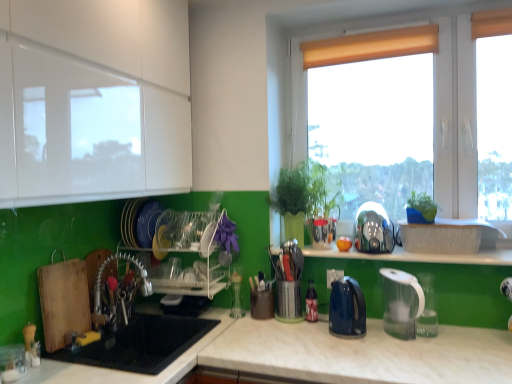
Describe the element at coordinates (401, 303) in the screenshot. I see `clear plastic water filter at lower right, acting as the 1th kitchen appliance starting from the right` at that location.

The image size is (512, 384). What do you see at coordinates (303, 195) in the screenshot? I see `green matte plant at center, the 2th plant viewed from the front` at bounding box center [303, 195].

Where is `green plastic plant at right, the 2th plant in the left-to-right sequence`? The width and height of the screenshot is (512, 384). green plastic plant at right, the 2th plant in the left-to-right sequence is located at coordinates (421, 209).

The image size is (512, 384). Describe the element at coordinates (373, 229) in the screenshot. I see `shiny metallic kettle at center-right, which is the 2th appliance in bottom-to-top order` at that location.

The width and height of the screenshot is (512, 384). What do you see at coordinates (311, 303) in the screenshot?
I see `translucent plastic bottle at center` at bounding box center [311, 303].

The image size is (512, 384). Identify the location of translucent plastic bottle at center. (311, 303).

At what (x,y) coordinates should I click in order to perform the action: click on clear plastic water filter at lower right, which ranks as the second kitchen appliance in left-to-right order. Please return your answer as a coordinate pair (x, y). The image size is (512, 384). Looking at the image, I should click on (401, 303).

Is brushed metal faucet at lower left at the left side of black matte sink at lower left?

Yes.

From a real-world perspective, is brushed metal faucet at lower left positioned over black matte sink at lower left based on gravity?

Indeed, from a real-world perspective, brushed metal faucet at lower left stands above black matte sink at lower left.

Considering the points (129, 261) and (149, 353), which point is in front, point (129, 261) or point (149, 353)?

The point (149, 353) is in front.

Consider the image. Is black matte sink at lower left at the back of brushed metal faucet at lower left?

No.

At what (x,y) coordinates should I click in order to perform the action: click on window that appears above the metallic silver toaster at center (from the image's perspective). Please return your answer as a coordinate pair (x, y). Looking at the image, I should click on pyautogui.click(x=455, y=116).

Which object is positioned more to the left, matte white window at upper right or metallic silver toaster at center?

Positioned to the left is metallic silver toaster at center.

Which object is more forward, matte white window at upper right or metallic silver toaster at center?

Positioned in front is metallic silver toaster at center.

Considering the sizes of objects green matte plant at center, which appears as the 1th plant when viewed from the left, and matte white window at upper right in the image provided, who is smaller, green matte plant at center, which appears as the 1th plant when viewed from the left, or matte white window at upper right?

Smaller between the two is green matte plant at center, which appears as the 1th plant when viewed from the left.

Which object is thinner, green matte plant at center, the 2th plant viewed from the front, or matte white window at upper right?

matte white window at upper right.

Does green matte plant at center, the 2th plant viewed from the front, have a lesser height compared to matte white window at upper right?

Yes.

Based on the photo, can you tell me how much clear plastic water filter at lower right, acting as the 1th kitchen appliance starting from the right, and brushed metal faucet at lower left differ in facing direction?

There is a 59.1-degree angle between the facing directions of clear plastic water filter at lower right, acting as the 1th kitchen appliance starting from the right, and brushed metal faucet at lower left.

Does point (390, 332) come farther from viewer compared to point (129, 258)?

No, it is not.

From a real-world perspective, which object stands above the other?

In real-world perspective, brushed metal faucet at lower left is above.

Looking at their sizes, would you say clear plastic water filter at lower right, which ranks as the second kitchen appliance in left-to-right order, is wider or thinner than brushed metal faucet at lower left?

Clearly, clear plastic water filter at lower right, which ranks as the second kitchen appliance in left-to-right order, has more width compared to brushed metal faucet at lower left.

Locate an element on the screen. This screenshot has height=384, width=512. bottle on the right of black matte sink at lower left is located at coordinates (311, 303).

In the scene shown: Is black matte sink at lower left closer to the viewer compared to translucent plastic bottle at center?

Yes, it is.

Is black matte sink at lower left thinner than translucent plastic bottle at center?

Incorrect, the width of black matte sink at lower left is not less than that of translucent plastic bottle at center.

Considering the sizes of objects black matte sink at lower left and translucent plastic bottle at center in the image provided, who is smaller, black matte sink at lower left or translucent plastic bottle at center?

Smaller between the two is translucent plastic bottle at center.

Which object is closer to the camera taking this photo, metallic utensil holder at center, acting as the 1th appliance starting from the left, or translucent plastic bottle at center?

Positioned in front is metallic utensil holder at center, acting as the 1th appliance starting from the left.

In the scene shown: Based on their positions, is metallic utensil holder at center, which is the 2th appliance in right-to-left order, located to the left or right of translucent plastic bottle at center?

Clearly, metallic utensil holder at center, which is the 2th appliance in right-to-left order, is on the left of translucent plastic bottle at center in the image.

Can you confirm if metallic utensil holder at center, the first appliance in the bottom-to-top sequence, is smaller than translucent plastic bottle at center?

Actually, metallic utensil holder at center, the first appliance in the bottom-to-top sequence, might be larger than translucent plastic bottle at center.

From their relative heights in the image, would you say metallic utensil holder at center, the 2th appliance in the top-to-bottom sequence, is taller or shorter than translucent plastic bottle at center?

Clearly, metallic utensil holder at center, the 2th appliance in the top-to-bottom sequence, is taller compared to translucent plastic bottle at center.

From the image's perspective, is translucent plastic bottle at center above metallic utensil holder at center, the first appliance in the bottom-to-top sequence?

No, from the image's perspective, translucent plastic bottle at center is not over metallic utensil holder at center, the first appliance in the bottom-to-top sequence.

Find the location of `appliance lying on the left of translucent plastic bottle at center`. appliance lying on the left of translucent plastic bottle at center is located at coordinates (288, 281).

Is translucent plastic bottle at center looking in the opposite direction of metallic utensil holder at center, the first appliance in the bottom-to-top sequence?

No, translucent plastic bottle at center is not facing the opposite direction of metallic utensil holder at center, the first appliance in the bottom-to-top sequence.

Is translucent plastic bottle at center not within metallic utensil holder at center, the first appliance in the bottom-to-top sequence?

Yes, translucent plastic bottle at center is located beyond the bounds of metallic utensil holder at center, the first appliance in the bottom-to-top sequence.

You are a GUI agent. You are given a task and a screenshot of the screen. Output one action in this format:
    pyautogui.click(x=<x>, y=<y>)
    Task: Click on the faucet above the black matte sink at lower left (from the image's perspective)
    The image size is (512, 384).
    Given the screenshot: What is the action you would take?
    pyautogui.click(x=119, y=293)

The width and height of the screenshot is (512, 384). Find the location of `window that is above the metallic silver toaster at center (from a real-world perspective)`. window that is above the metallic silver toaster at center (from a real-world perspective) is located at coordinates (455, 116).

Which object lies further to the anchor point blue glossy electric kettle at center, which appears as the 1th kitchen appliance when viewed from the left, matte white window at upper right or translucent plastic bottle at center?

The object further to blue glossy electric kettle at center, which appears as the 1th kitchen appliance when viewed from the left, is matte white window at upper right.

From the image, which object appears to be nearer to brushed metal faucet at lower left, translucent plastic bottle at center or clear plastic water filter at lower right, which ranks as the second kitchen appliance in left-to-right order?

translucent plastic bottle at center is closer to brushed metal faucet at lower left.

Estimate the real-world distances between objects in this image. Which object is closer to shiny metallic kettle at center-right, the 1th appliance from the right, blue glossy electric kettle at center, which appears as the 1th kitchen appliance when viewed from the left, or beige fabric curtain at upper center?

Among the two, blue glossy electric kettle at center, which appears as the 1th kitchen appliance when viewed from the left, is located nearer to shiny metallic kettle at center-right, the 1th appliance from the right.

Considering their positions, is matte white window at upper right positioned further to brushed metal faucet at lower left than translucent plastic bottle at center?

Among the two, matte white window at upper right is located further to brushed metal faucet at lower left.

Based on their spatial positions, is shiny metallic kettle at center-right, the 1th appliance from the right, or metallic utensil holder at center, the 2th appliance in the top-to-bottom sequence, closer to beige fabric curtain at upper center?

shiny metallic kettle at center-right, the 1th appliance from the right, lies closer to beige fabric curtain at upper center than the other object.

Based on the photo, looking at the image, which one is located further to shiny metallic kettle at center-right, which is the 2th appliance in bottom-to-top order, beige fabric curtain at upper center or clear plastic water filter at lower right, acting as the 1th kitchen appliance starting from the right?

Among the two, beige fabric curtain at upper center is located further to shiny metallic kettle at center-right, which is the 2th appliance in bottom-to-top order.

When comparing their distances from green plastic plant at right, which is the first plant in front-to-back order, does blue glossy electric kettle at center, the 2th kitchen appliance in the right-to-left sequence, or translucent plastic bottle at center seem closer?

blue glossy electric kettle at center, the 2th kitchen appliance in the right-to-left sequence, is positioned closer to the anchor green plastic plant at right, which is the first plant in front-to-back order.

Estimate the real-world distances between objects in this image. Which object is further from clear plastic water filter at lower right, which ranks as the second kitchen appliance in left-to-right order, green plastic plant at right, arranged as the 1th plant when viewed from the right, or translucent plastic bottle at center?

translucent plastic bottle at center is positioned further to the anchor clear plastic water filter at lower right, which ranks as the second kitchen appliance in left-to-right order.

The width and height of the screenshot is (512, 384). What are the coordinates of `shelf between brushed metal faucet at lower left and matte white window at upper right from left to right` in the screenshot? It's located at (185, 276).

Find the location of `shelf between black matte sink at lower left and shiny metallic kettle at center-right, the 1th appliance from the right`. shelf between black matte sink at lower left and shiny metallic kettle at center-right, the 1th appliance from the right is located at coordinates (185, 276).

The width and height of the screenshot is (512, 384). In order to click on appliance between black matte sink at lower left and shiny metallic kettle at center-right, the 1th appliance from the right, from left to right in this screenshot , I will do `click(288, 281)`.

This screenshot has width=512, height=384. What are the coordinates of `window between beige fabric curtain at upper center and green plastic plant at right, which is the first plant in front-to-back order, in the vertical direction` in the screenshot? It's located at (455, 116).